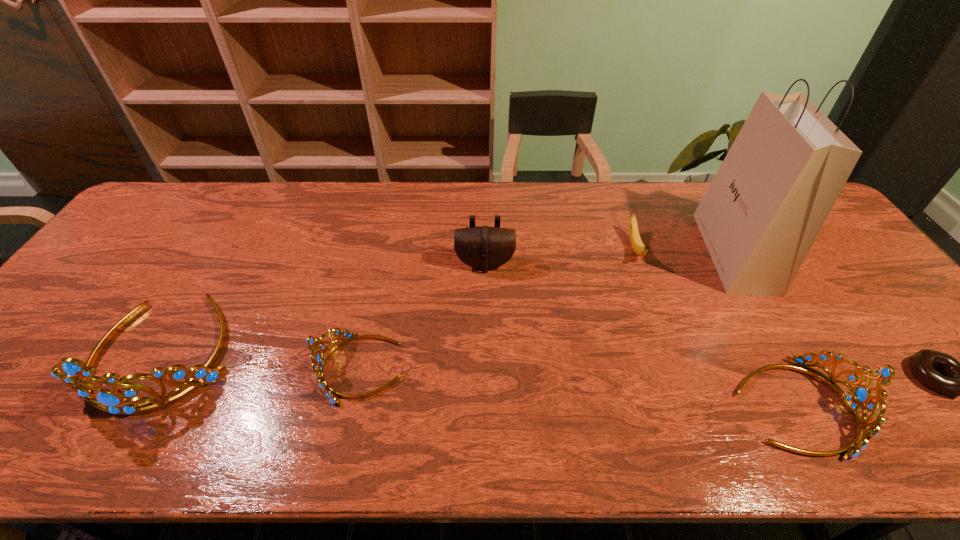
You are a GUI agent. You are given a task and a screenshot of the screen. Output one action in this format:
    pyautogui.click(x=<x>, y=<y>)
    Task: Click on the vacant point located between the leftmost tiara and the rightmost tiara
    
    Given the screenshot: What is the action you would take?
    pyautogui.click(x=480, y=379)

I want to click on free space between the second object from left to right and the pouch, so click(423, 316).

Locate an element on the screen. This screenshot has height=540, width=960. unoccupied position between the leftmost object and the fourth object from left to right is located at coordinates (400, 300).

Image resolution: width=960 pixels, height=540 pixels. I want to click on free spot between the second shortest tiara and the second object from left to right, so click(579, 387).

Locate an element on the screen. The image size is (960, 540). vacant region between the pouch and the second shortest tiara is located at coordinates (640, 335).

The height and width of the screenshot is (540, 960). Find the location of `empty space that is in between the tallest tiara and the fourth object from right to left`. empty space that is in between the tallest tiara and the fourth object from right to left is located at coordinates (400, 300).

Locate an element on the screen. The width and height of the screenshot is (960, 540). the fifth closest object relative to the second tallest object is located at coordinates (762, 212).

Identify which object is located as the nearest to the tallest tiara. Please provide its 2D coordinates. Your answer should be formatted as a tuple, i.e. [(x, y)], where the tuple contains the x and y coordinates of a point satisfying the conditions above.

[(318, 362)]

I want to click on tiara identified as the second closest to the second tallest tiara, so click(x=75, y=373).

At what (x,y) coordinates should I click in order to perform the action: click on tiara that is the second closest to the tallest object. Please return your answer as a coordinate pair (x, y). Image resolution: width=960 pixels, height=540 pixels. Looking at the image, I should click on (318, 362).